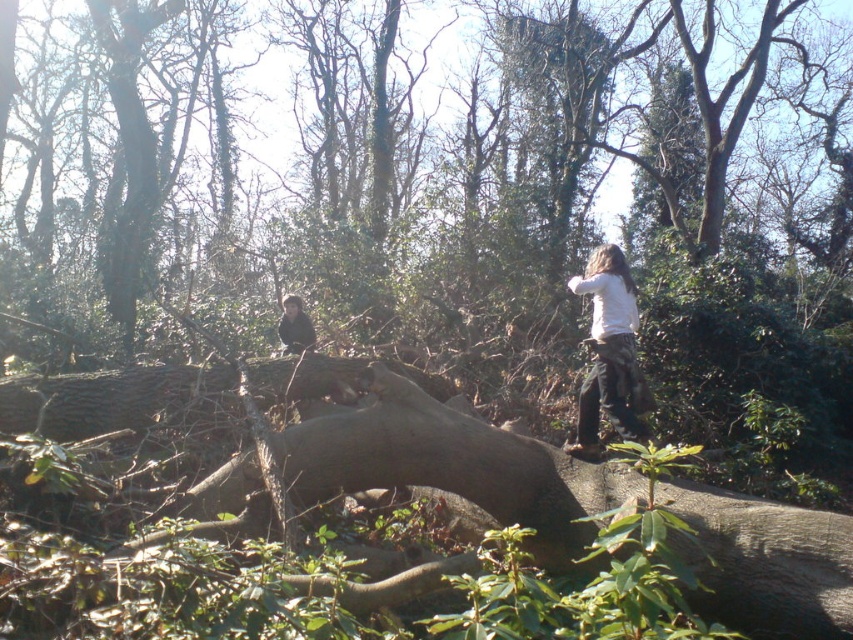
Question: Among these objects, which one is nearest to the camera?

Choices:
 (A) dark brown hair at upper center
 (B) white cotton shirt at center

Answer: (B)

Question: Is brown rough tree trunk at center bigger than dark brown hair at upper center?

Choices:
 (A) yes
 (B) no

Answer: (A)

Question: Can you confirm if white cotton shirt at center is thinner than dark brown hair at upper center?

Choices:
 (A) yes
 (B) no

Answer: (B)

Question: Which of these objects is positioned closest to the white cotton shirt at center?

Choices:
 (A) brown rough tree trunk at center
 (B) dark brown hair at upper center

Answer: (A)

Question: Observing the image, what is the correct spatial positioning of white cotton shirt at center in reference to dark brown hair at upper center?

Choices:
 (A) left
 (B) right

Answer: (B)

Question: Which of the following is the closest to the observer?

Choices:
 (A) (619, 378)
 (B) (704, 497)
 (C) (279, 317)

Answer: (B)